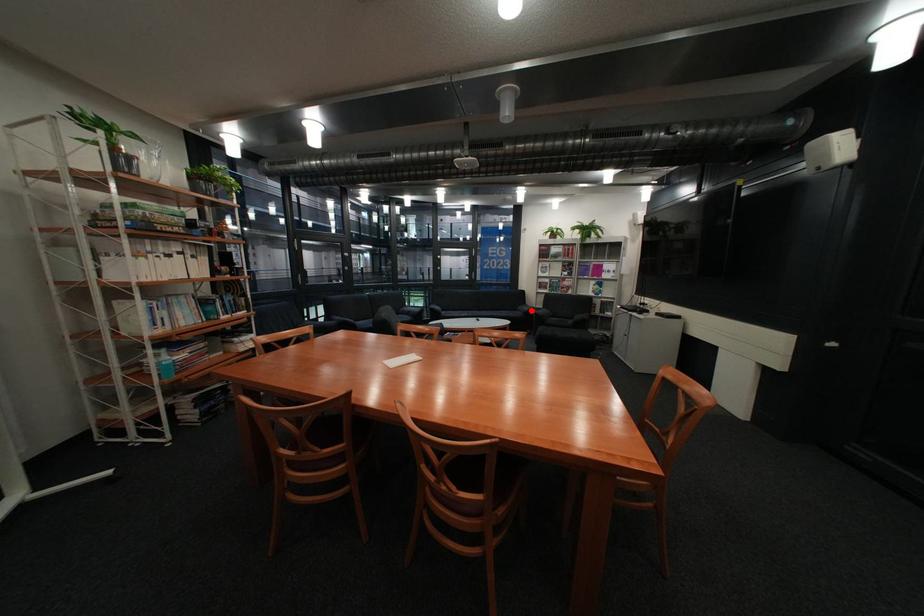
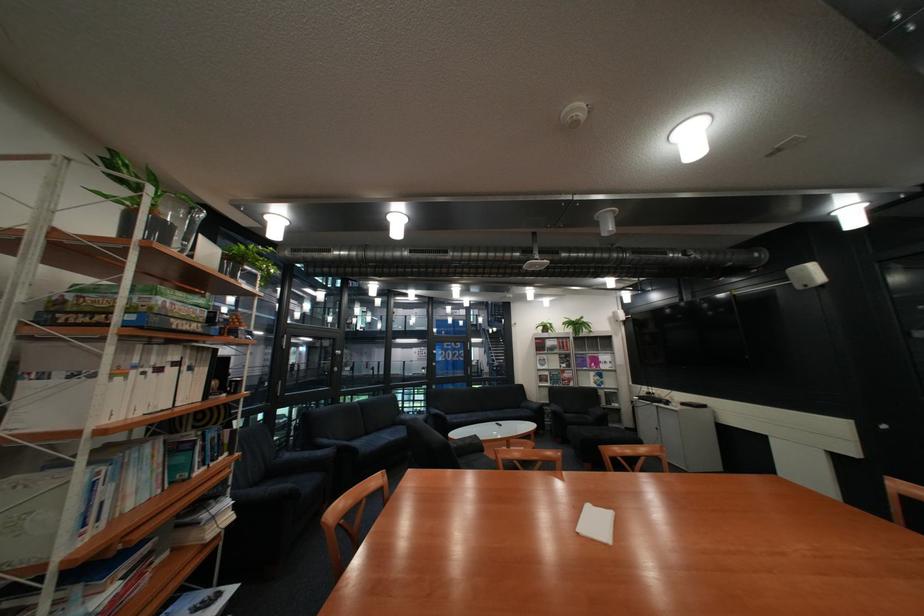
Question: A red point is marked in image1. In image2, is the corresponding 3D point closer to the camera or farther? Reply with the corresponding letter.

Choices:
 (A) The corresponding 3D point is closer.
 (B) The corresponding 3D point is farther.

Answer: (B)